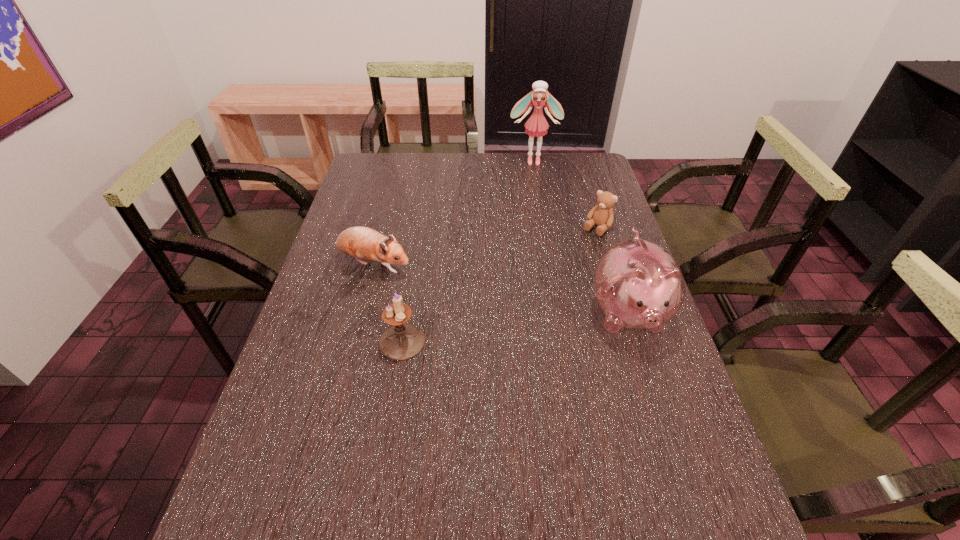
This screenshot has height=540, width=960. I want to click on vacant area that lies between the fourth nearest object and the hamster, so click(x=485, y=247).

I want to click on free spot between the third farthest object and the piggy bank, so click(501, 289).

The image size is (960, 540). I want to click on free space between the tallest object and the second farthest object, so click(565, 194).

Where is `free space between the farthest object and the piggy bank`? free space between the farthest object and the piggy bank is located at coordinates (582, 238).

Locate an element on the screen. vacant point located between the hamster and the fourth shortest object is located at coordinates (501, 289).

You are a GUI agent. You are given a task and a screenshot of the screen. Output one action in this format:
    pyautogui.click(x=<x>, y=<y>)
    Task: Click on the empty space between the hamster and the third tallest object
    The width and height of the screenshot is (960, 540).
    Given the screenshot: What is the action you would take?
    pyautogui.click(x=388, y=303)

Identify the location of vacant space that's between the tallest object and the piggy bank. This screenshot has width=960, height=540. (582, 238).

Identify the location of unoccupied position between the farthest object and the piggy bank. This screenshot has width=960, height=540. (582, 238).

Choose which object is the third nearest neighbor to the farthest object. Please provide its 2D coordinates. Your answer should be formatted as a tuple, i.e. [(x, y)], where the tuple contains the x and y coordinates of a point satisfying the conditions above.

[(638, 284)]

Image resolution: width=960 pixels, height=540 pixels. I want to click on object that is the second closest to the hamster, so click(x=638, y=284).